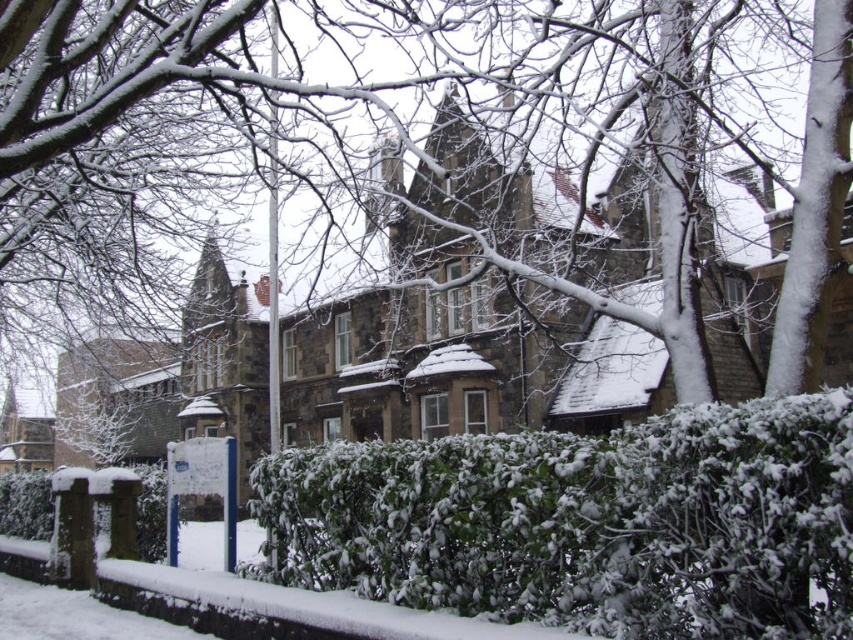
Question: Does snow-covered tree at upper center have a greater width compared to green leafy bush at center?

Choices:
 (A) no
 (B) yes

Answer: (B)

Question: Which object appears farthest from the camera in this image?

Choices:
 (A) green leafy bush at center
 (B) snow-covered tree at upper center

Answer: (B)

Question: Does snow-covered tree at upper center appear on the left side of green leafy bush at center?

Choices:
 (A) yes
 (B) no

Answer: (A)

Question: Can you confirm if snow-covered tree at upper center is positioned above green leafy bush at center?

Choices:
 (A) yes
 (B) no

Answer: (A)